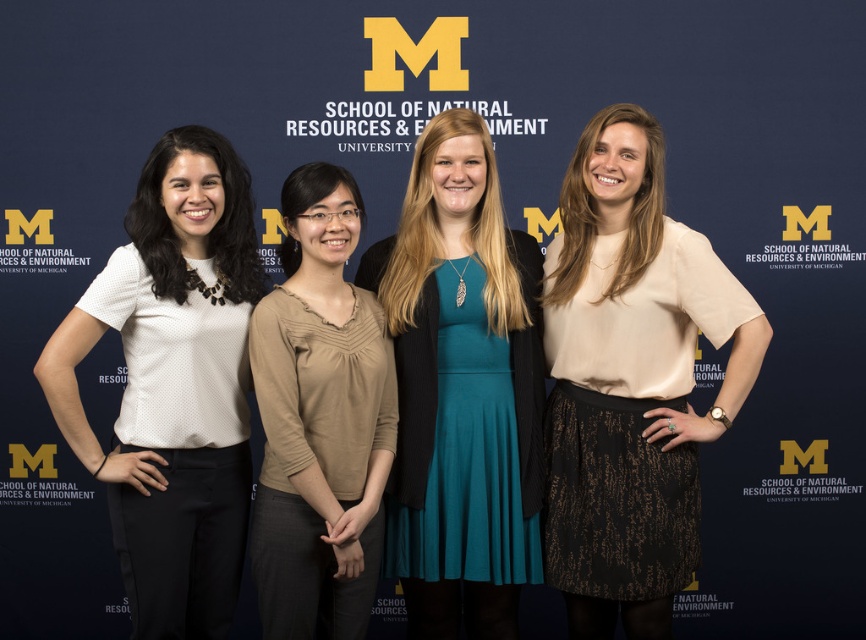
Is point (192, 573) positioned before point (372, 500)?

No, it is behind (372, 500).

Does white dotted blouse at left appear under tan soft fabric blouse at center?

No.

Is point (181, 401) farther from viewer compared to point (363, 515)?

Yes, it is behind point (363, 515).

This screenshot has width=866, height=640. Find the location of `white dotted blouse at left`. white dotted blouse at left is located at coordinates (173, 385).

Is the position of matte beige blouse at center more distant than that of white dotted blouse at left?

Yes.

This screenshot has width=866, height=640. What do you see at coordinates (630, 381) in the screenshot? I see `matte beige blouse at center` at bounding box center [630, 381].

Which is in front, point (561, 193) or point (231, 337)?

Point (231, 337) is in front.

Where is `matte beige blouse at center`? The image size is (866, 640). matte beige blouse at center is located at coordinates (630, 381).

At what (x,y) coordinates should I click in order to perform the action: click on white dotted blouse at left. Please return your answer as a coordinate pair (x, y). The width and height of the screenshot is (866, 640). Looking at the image, I should click on (173, 385).

Is point (199, 508) farther from viewer compared to point (405, 332)?

No, (199, 508) is in front of (405, 332).

This screenshot has height=640, width=866. Identify the location of white dotted blouse at left. [x=173, y=385].